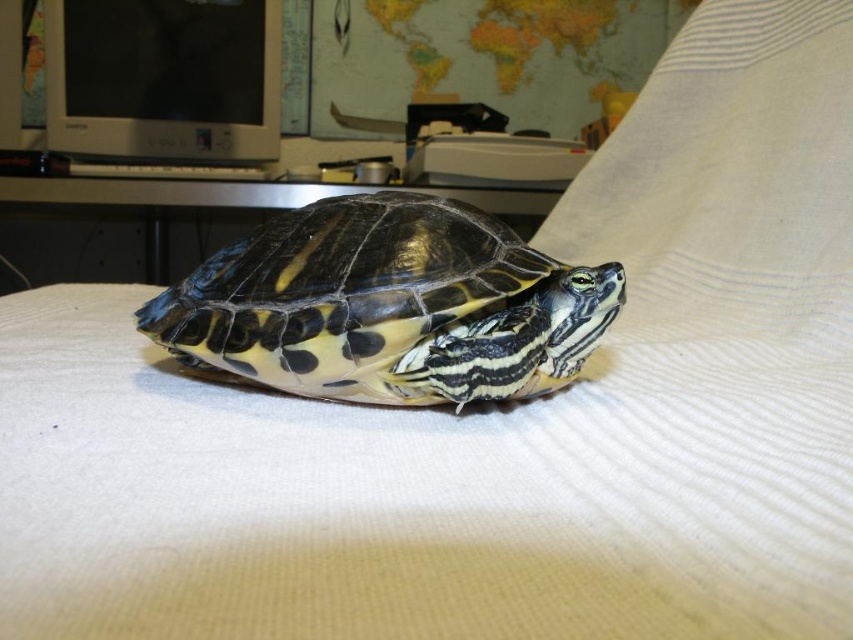
Is point (260, 33) positioned behind point (364, 188)?

No.

Is point (109, 90) positioned after point (183, 250)?

No, (109, 90) is closer to viewer.

You are a GUI agent. You are given a task and a screenshot of the screen. Output one action in this format:
    pyautogui.click(x=<x>, y=<y>)
    Task: Click on the matte silver computer monitor at upper left
    
    Given the screenshot: What is the action you would take?
    pyautogui.click(x=163, y=80)

Can you confirm if shiny black tortoise at center is smaller than metallic silver table at center?

Correct, shiny black tortoise at center occupies less space than metallic silver table at center.

Based on the photo, measure the distance from shiny black tortoise at center to metallic silver table at center.

1.36 meters

Who is more distant from viewer, (474, 332) or (172, 224)?

Point (172, 224)

At what (x,y) coordinates should I click in order to perform the action: click on shiny black tortoise at center. Please return your answer as a coordinate pair (x, y). This screenshot has height=640, width=853. Looking at the image, I should click on (387, 305).

Which is in front, point (178, 349) or point (252, 22)?

Point (178, 349)

Is shiny black tortoise at center in front of matte silver computer monitor at upper left?

Yes, shiny black tortoise at center is closer to the viewer.

Where is `shiny black tortoise at center`? Image resolution: width=853 pixels, height=640 pixels. shiny black tortoise at center is located at coordinates (387, 305).

Locate an element on the screen. The image size is (853, 640). shiny black tortoise at center is located at coordinates (387, 305).